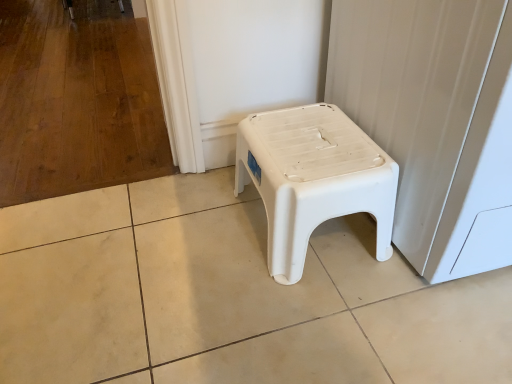
This screenshot has width=512, height=384. What are the coordinates of `space that is in front of white plastic stool at center` in the screenshot? It's located at (322, 322).